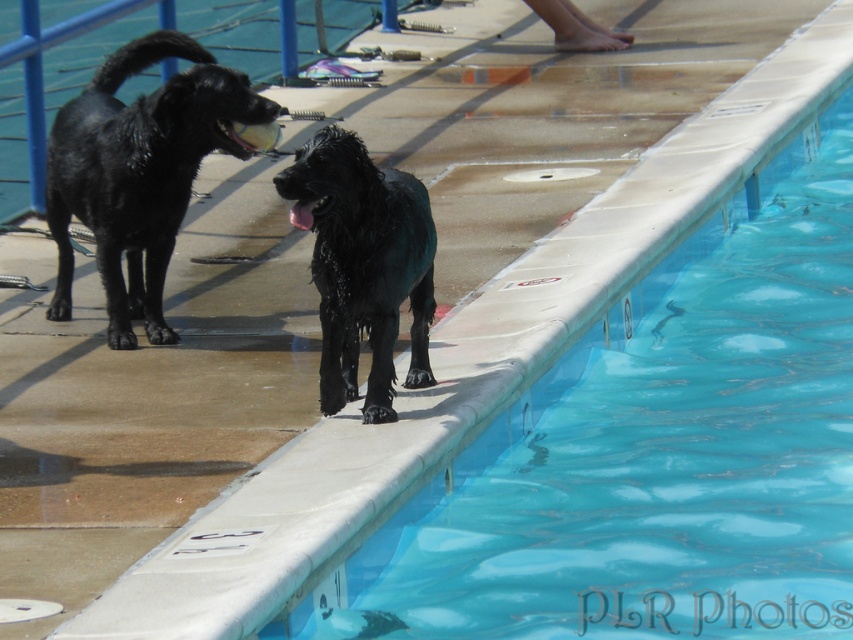
Does wet glossy black dog at center appear on the right side of brushed metal rail at left?

Yes, wet glossy black dog at center is to the right of brushed metal rail at left.

Does point (386, 394) come in front of point (207, 13)?

Yes, point (386, 394) is in front of point (207, 13).

Which is in front, point (354, 324) or point (152, 84)?

Point (354, 324) is more forward.

You are a GUI agent. You are given a task and a screenshot of the screen. Output one action in this format:
    pyautogui.click(x=<x>, y=<y>)
    Task: Click on the wet glossy black dog at center
    
    Given the screenshot: What is the action you would take?
    pyautogui.click(x=363, y=264)

Does smooth concrete edge at upper right lie in front of brushed metal rail at left?

Yes.

Image resolution: width=853 pixels, height=640 pixels. Identify the location of smooth concrete edge at upper right. (653, 451).

Which is in front, point (492, 476) or point (16, 156)?

Point (492, 476) is more forward.

Where is `smooth concrete edge at upper right`? Image resolution: width=853 pixels, height=640 pixels. smooth concrete edge at upper right is located at coordinates (653, 451).

Can you confirm if shiny black dog at left is smaller than brushed metal rail at left?

Incorrect, shiny black dog at left is not smaller in size than brushed metal rail at left.

Does shiny black dog at left appear on the right side of brushed metal rail at left?

Correct, you'll find shiny black dog at left to the right of brushed metal rail at left.

Who is more distant from viewer, (183, 154) or (1, 68)?

The point (1, 68) is more distant.

You are a GUI agent. You are given a task and a screenshot of the screen. Output one action in this format:
    pyautogui.click(x=<x>, y=<y>)
    Task: Click on the shiny black dog at left
    The image size is (853, 640).
    Given the screenshot: What is the action you would take?
    pyautogui.click(x=138, y=172)